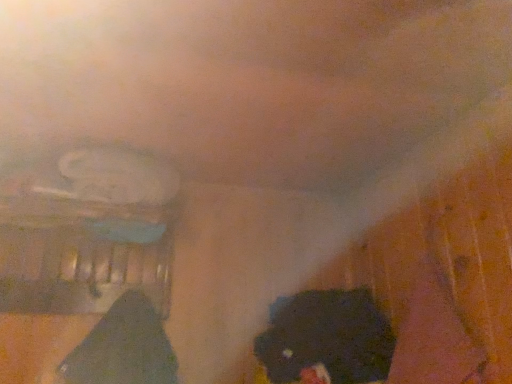
What do you see at coordinates (327, 337) in the screenshot? The height and width of the screenshot is (384, 512). I see `dark matte fabric at lower right` at bounding box center [327, 337].

The height and width of the screenshot is (384, 512). Find the location of `dark matte fabric at lower right`. dark matte fabric at lower right is located at coordinates (327, 337).

In order to face dark matte fabric at lower right, should I rotate leftwards or rightwards?

You should rotate right by 8.616 degrees.

I want to click on dark matte fabric at lower right, so click(x=327, y=337).